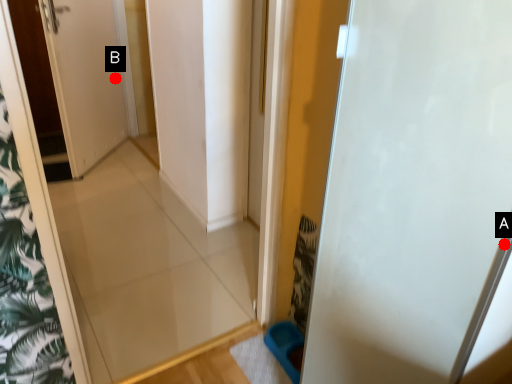
Question: Two points are circled on the image, labeled by A and B beside each circle. Which point is closer to the camera?

Choices:
 (A) A is closer
 (B) B is closer

Answer: (A)